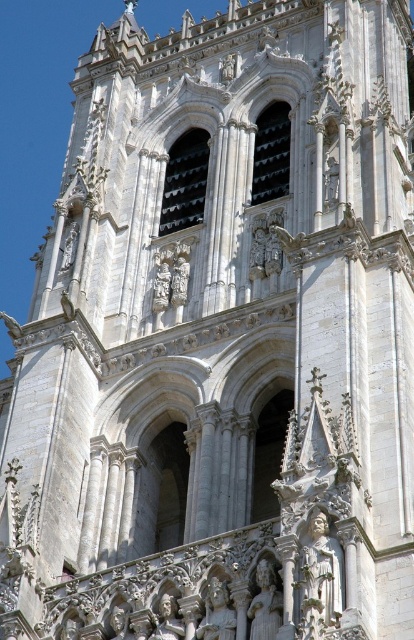
Question: Does white stone statue at center appear over polished silver statue at center?

Choices:
 (A) yes
 (B) no

Answer: (A)

Question: Which of the following is the closest to the observer?

Choices:
 (A) (163, 616)
 (B) (307, 554)
 (C) (274, 634)

Answer: (C)

Question: Considering the relative positions of white stone statue at lower center and polished stone statue at center in the image provided, where is white stone statue at lower center located with respect to polished stone statue at center?

Choices:
 (A) below
 (B) above

Answer: (B)

Question: Which of the following is the farthest from the observer?

Choices:
 (A) (317, 618)
 (B) (224, 611)

Answer: (B)

Question: Among these objects, which one is farthest from the camera?

Choices:
 (A) white stone statue at center
 (B) polished silver statue at center

Answer: (B)

Question: Does polished stone statue at center appear on the left side of polished silver statue at center?

Choices:
 (A) no
 (B) yes

Answer: (A)